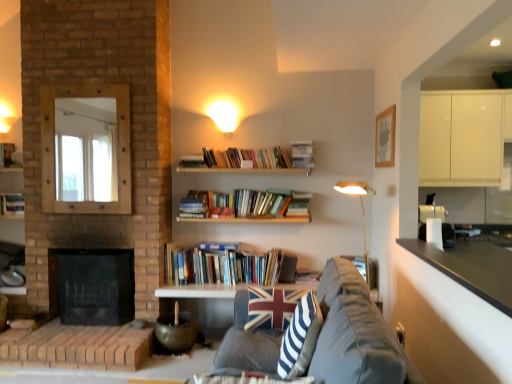
I want to click on vacant space situated above wooden mirror at left (from a real-world perspective), so point(86,87).